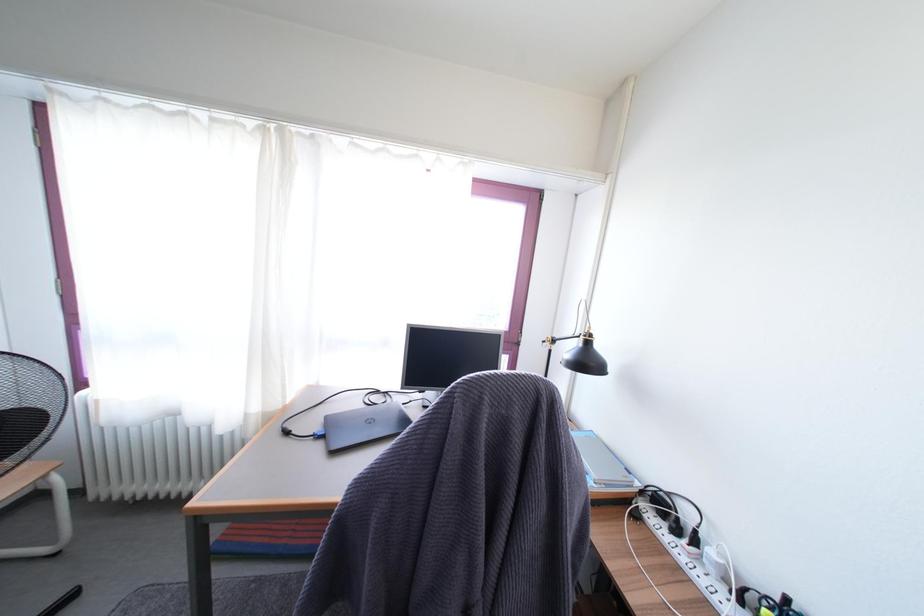
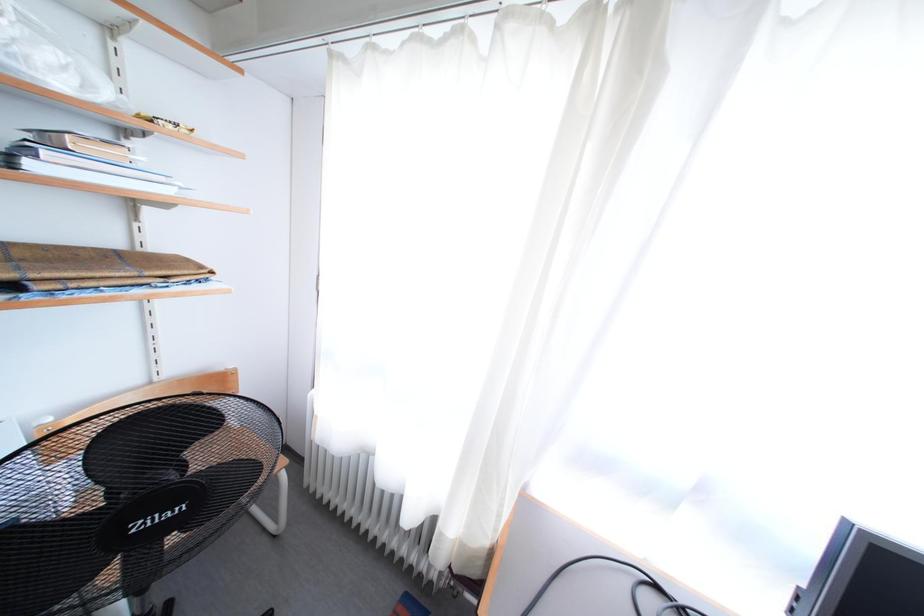
Question: The camera is either moving clockwise (left) or counter-clockwise (right) around the object. The first image is from the beginning of the video and the second image is from the end. Is the camera moving left or right when shooting the video?

Choices:
 (A) Left
 (B) Right

Answer: (B)